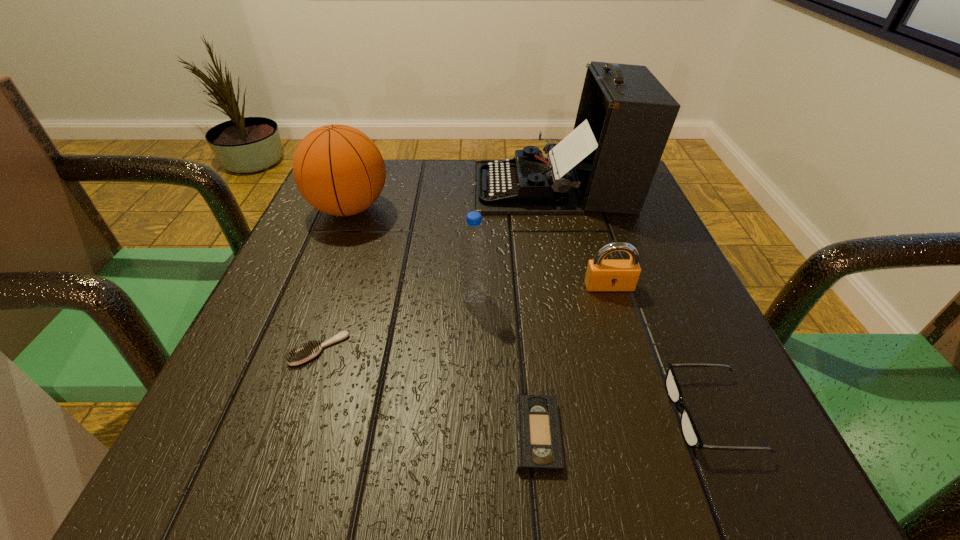
This screenshot has height=540, width=960. Identify the location of the tallest object. (607, 163).

The image size is (960, 540). Identify the location of basketball. (338, 169).

This screenshot has width=960, height=540. What are the coordinates of `water bottle` in the screenshot? It's located at (474, 244).

I want to click on padlock, so click(x=602, y=274).

Where is `spectacles`? The width and height of the screenshot is (960, 540). spectacles is located at coordinates tap(690, 433).

Where is `the second shortest object`? the second shortest object is located at coordinates (313, 348).

The width and height of the screenshot is (960, 540). Find the location of `scrubbing brush`. scrubbing brush is located at coordinates (313, 348).

You are a GUI agent. You are given a task and a screenshot of the screen. Output one action in this format:
    pyautogui.click(x=<x>, y=<y>)
    Task: Click on the shortest object
    
    Given the screenshot: What is the action you would take?
    pyautogui.click(x=538, y=438)

Locate an element on the screen. vacant area situated 0.320m inside the open case of the typewriter is located at coordinates (334, 187).

Where is `vacant region located inside the open case of the typewriter`? This screenshot has height=540, width=960. vacant region located inside the open case of the typewriter is located at coordinates point(451,187).